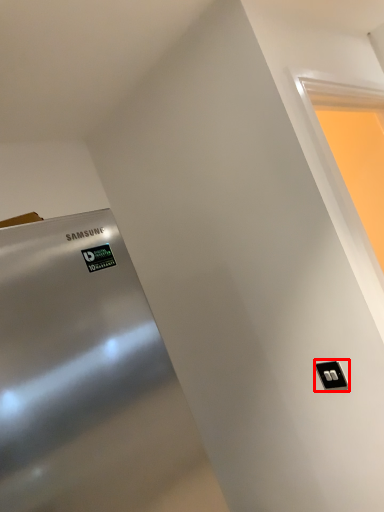
Question: Considering the relative positions of light switch (annotated by the red box) and window in the image provided, where is light switch (annotated by the red box) located with respect to the staircase?

Choices:
 (A) right
 (B) left

Answer: (B)